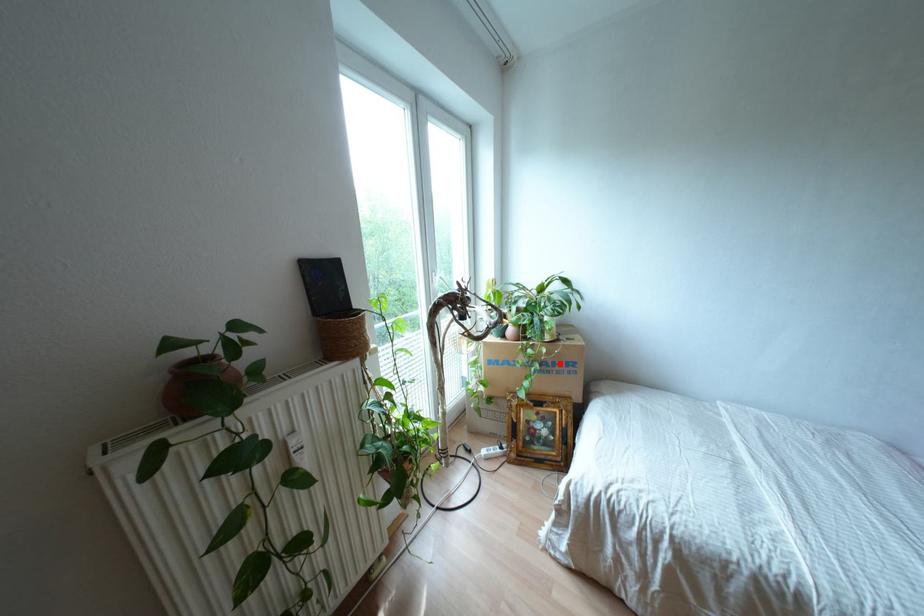
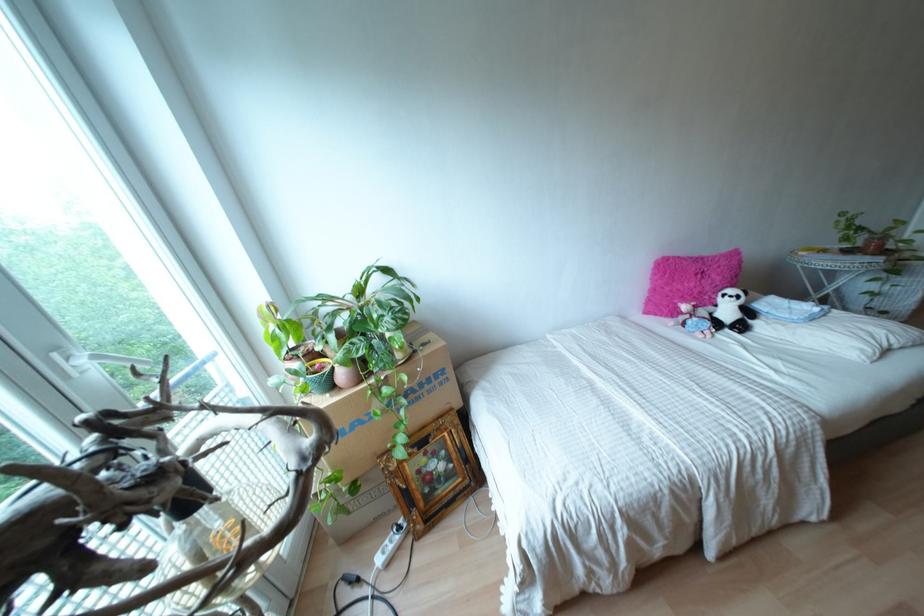
Find the pixel in the second image that matches the highlighted location in the first image.

(428, 379)